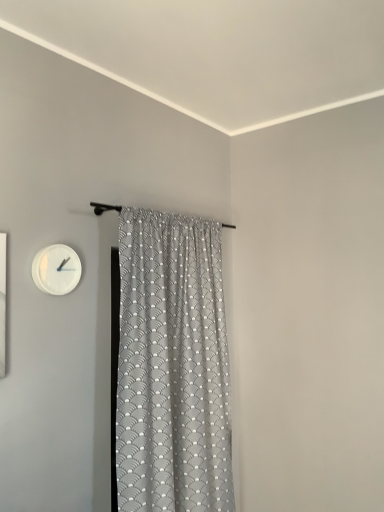
Question: Considering the positions of gray textured fabric curtain at center and white matte wall clock at upper left in the image, is gray textured fabric curtain at center wider or thinner than white matte wall clock at upper left?

Choices:
 (A) thin
 (B) wide

Answer: (B)

Question: Relative to white matte wall clock at upper left, is gray textured fabric curtain at center in front or behind?

Choices:
 (A) front
 (B) behind

Answer: (A)

Question: From the image's perspective, is gray textured fabric curtain at center above or below white matte wall clock at upper left?

Choices:
 (A) below
 (B) above

Answer: (A)

Question: Considering the positions of point (46, 270) and point (183, 407), is point (46, 270) closer or farther from the camera than point (183, 407)?

Choices:
 (A) farther
 (B) closer

Answer: (B)

Question: Looking at the image, does white matte wall clock at upper left seem bigger or smaller compared to gray textured fabric curtain at center?

Choices:
 (A) big
 (B) small

Answer: (B)

Question: Considering the positions of white matte wall clock at upper left and gray textured fabric curtain at center in the image, is white matte wall clock at upper left taller or shorter than gray textured fabric curtain at center?

Choices:
 (A) short
 (B) tall

Answer: (A)

Question: Is white matte wall clock at upper left in front of or behind gray textured fabric curtain at center in the image?

Choices:
 (A) front
 (B) behind

Answer: (B)